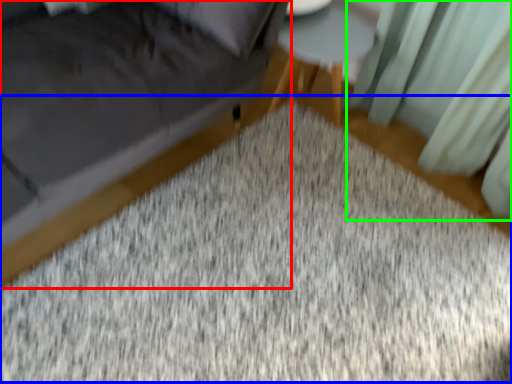
Question: Which object is the closest to the furniture (highlighted by a red box)? Choose among these: mat (highlighted by a blue box) or curtain (highlighted by a green box).

Choices:
 (A) mat
 (B) curtain

Answer: (A)